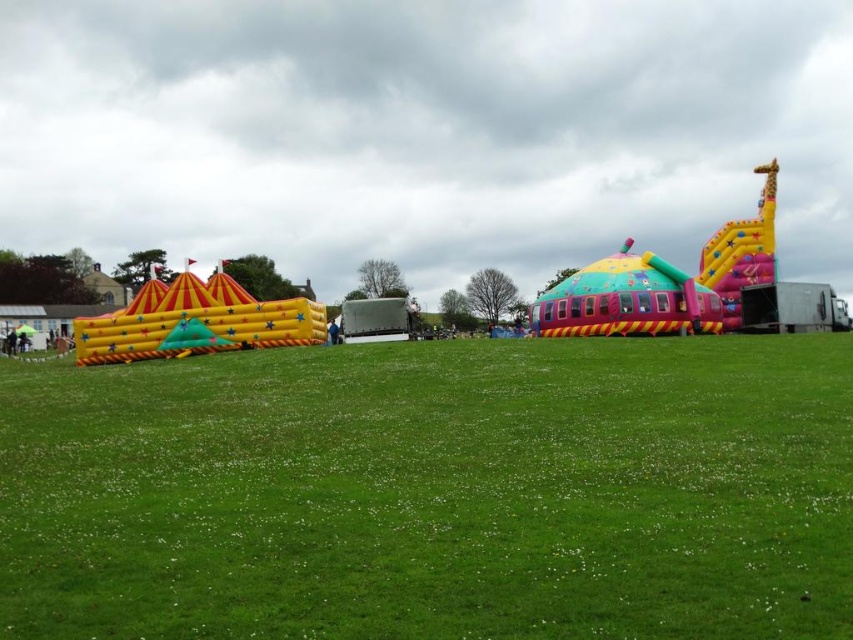
You are standing on the green grass at center and want to reach the multicolored inflatable castle at center. Which direction should you move to get there?

You should move to the left because the green grass at center is on the right side of the multicolored inflatable castle at center, so moving left will bring you towards it.

You are a landscape architect designing a new park and want to place both the green grass at center and the multicolored inflatable castle at center in the same area. Based on the image, which object takes up more space in the scene?

The multicolored inflatable castle at center takes up more space than the green grass at center in the scene.